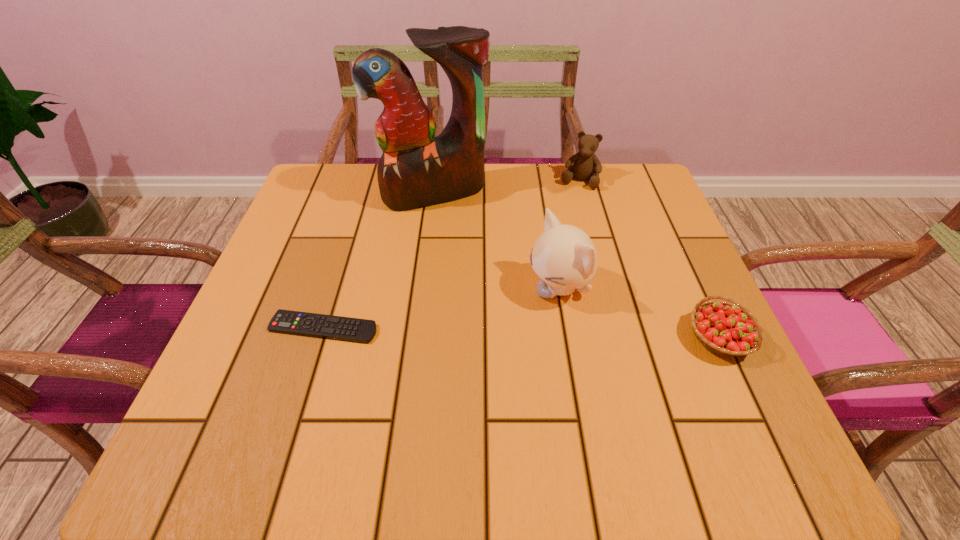
The height and width of the screenshot is (540, 960). Identify the location of the shortest object. (339, 328).

Identify the location of the rightmost object. (729, 329).

Where is `strawberry`? strawberry is located at coordinates (729, 329).

You are a GUI agent. You are given a task and a screenshot of the screen. Output one action in this format:
    pyautogui.click(x=<x>, y=<y>)
    Task: Click on the third tallest object
    
    Given the screenshot: What is the action you would take?
    pyautogui.click(x=586, y=165)

The width and height of the screenshot is (960, 540). Identify the location of kitten. (564, 257).

I want to click on parrot, so click(417, 169).

The height and width of the screenshot is (540, 960). What are the coordinates of `blank space located 0.280m on the right of the remote control` in the screenshot? It's located at coord(523,328).

Image resolution: width=960 pixels, height=540 pixels. What are the coordinates of `vacant space located on the left of the rightmost object` in the screenshot? It's located at (473, 338).

I want to click on vacant area situated 0.400m on the front-facing side of the teddy bear, so click(538, 300).

Image resolution: width=960 pixels, height=540 pixels. I want to click on vacant space located 0.150m on the front-facing side of the teddy bear, so click(564, 225).